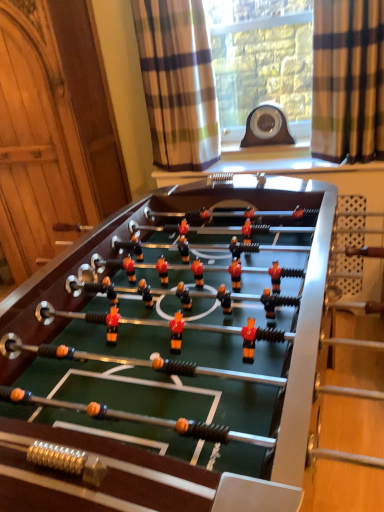
What do you see at coordinates (348, 80) in the screenshot? This screenshot has width=384, height=512. I see `brown plaid curtain at upper right, which is the first curtain in right-to-left order` at bounding box center [348, 80].

Where is `plaid fabric curtain at upper center, arranged as the 2th curtain when viewed from the right`? The height and width of the screenshot is (512, 384). plaid fabric curtain at upper center, arranged as the 2th curtain when viewed from the right is located at coordinates (178, 83).

Is there a large distance between brown plaid curtain at upper right, which is the first curtain in right-to-left order, and green felt table at center?

They are positioned close to each other.

From the picture: Is green felt table at center located within brown plaid curtain at upper right, which is the first curtain in right-to-left order?

No, green felt table at center is not a part of brown plaid curtain at upper right, which is the first curtain in right-to-left order.

Between brown plaid curtain at upper right, placed as the 2th curtain when sorted from left to right, and green felt table at center, which one has smaller width?

brown plaid curtain at upper right, placed as the 2th curtain when sorted from left to right, is thinner.

Can you confirm if green felt table at center is smaller than plaid fabric curtain at upper center, the first curtain viewed from the left?

No, green felt table at center is not smaller than plaid fabric curtain at upper center, the first curtain viewed from the left.

From a real-world perspective, is green felt table at center located higher than plaid fabric curtain at upper center, the first curtain viewed from the left?

No.

Is green felt table at center to the left of plaid fabric curtain at upper center, arranged as the 2th curtain when viewed from the right, from the viewer's perspective?

No.

Considering the positions of points (288, 280) and (202, 143), is point (288, 280) closer to camera compared to point (202, 143)?

Yes.

Which of these two, plaid fabric curtain at upper center, arranged as the 2th curtain when viewed from the right, or brown plaid curtain at upper right, which is the first curtain in right-to-left order, is thinner?

brown plaid curtain at upper right, which is the first curtain in right-to-left order.

Does plaid fabric curtain at upper center, arranged as the 2th curtain when viewed from the right, have a lesser height compared to brown plaid curtain at upper right, which is the first curtain in right-to-left order?

No.

Considering the sizes of objects plaid fabric curtain at upper center, arranged as the 2th curtain when viewed from the right, and brown plaid curtain at upper right, placed as the 2th curtain when sorted from left to right, in the image provided, who is smaller, plaid fabric curtain at upper center, arranged as the 2th curtain when viewed from the right, or brown plaid curtain at upper right, placed as the 2th curtain when sorted from left to right,?

With smaller size is brown plaid curtain at upper right, placed as the 2th curtain when sorted from left to right.

Can you tell me how much plaid fabric curtain at upper center, the first curtain viewed from the left, and brown plaid curtain at upper right, which is the first curtain in right-to-left order, differ in facing direction?

The angular difference between plaid fabric curtain at upper center, the first curtain viewed from the left, and brown plaid curtain at upper right, which is the first curtain in right-to-left order, is 2.56 degrees.

Which object is further away from the camera, plaid fabric curtain at upper center, arranged as the 2th curtain when viewed from the right, or green felt table at center?

plaid fabric curtain at upper center, arranged as the 2th curtain when viewed from the right, is more distant.

This screenshot has height=512, width=384. In order to click on table to the right of plaid fabric curtain at upper center, arranged as the 2th curtain when viewed from the right in this screenshot , I will do `click(167, 376)`.

Is plaid fabric curtain at upper center, the first curtain viewed from the left, aimed at green felt table at center?

Yes, plaid fabric curtain at upper center, the first curtain viewed from the left, is turned towards green felt table at center.

From a real-world perspective, is green felt table at center physically below brown plaid curtain at upper right, which is the first curtain in right-to-left order?

Indeed, from a real-world perspective, green felt table at center is positioned beneath brown plaid curtain at upper right, which is the first curtain in right-to-left order.

From the image's perspective, is green felt table at center over brown plaid curtain at upper right, which is the first curtain in right-to-left order?

Incorrect, from the image's perspective, green felt table at center is lower than brown plaid curtain at upper right, which is the first curtain in right-to-left order.

Between green felt table at center and brown plaid curtain at upper right, placed as the 2th curtain when sorted from left to right, which one has smaller width?

With smaller width is brown plaid curtain at upper right, placed as the 2th curtain when sorted from left to right.

From the image's perspective, is brown plaid curtain at upper right, placed as the 2th curtain when sorted from left to right, beneath plaid fabric curtain at upper center, arranged as the 2th curtain when viewed from the right?

Correct, brown plaid curtain at upper right, placed as the 2th curtain when sorted from left to right, appears lower than plaid fabric curtain at upper center, arranged as the 2th curtain when viewed from the right, in the image.

Can you confirm if brown plaid curtain at upper right, which is the first curtain in right-to-left order, is wider than plaid fabric curtain at upper center, arranged as the 2th curtain when viewed from the right?

Incorrect, the width of brown plaid curtain at upper right, which is the first curtain in right-to-left order, does not surpass that of plaid fabric curtain at upper center, arranged as the 2th curtain when viewed from the right.

In the image, there is a brown plaid curtain at upper right, which is the first curtain in right-to-left order. What are the coordinates of `curtain above it (from the image's perspective)` in the screenshot? It's located at (178, 83).

You are a GUI agent. You are given a task and a screenshot of the screen. Output one action in this format:
    pyautogui.click(x=<x>, y=<y>)
    Task: Click on the 1st curtain behind the green felt table at center
    Image resolution: width=384 pixels, height=512 pixels.
    Given the screenshot: What is the action you would take?
    pyautogui.click(x=348, y=80)

I want to click on curtain to the left of green felt table at center, so click(x=178, y=83).

Based on their spatial positions, is plaid fabric curtain at upper center, arranged as the 2th curtain when viewed from the right, or brown plaid curtain at upper right, which is the first curtain in right-to-left order, closer to green felt table at center?

plaid fabric curtain at upper center, arranged as the 2th curtain when viewed from the right, is closer to green felt table at center.

From the image, which object appears to be farther from brown plaid curtain at upper right, which is the first curtain in right-to-left order, plaid fabric curtain at upper center, the first curtain viewed from the left, or green felt table at center?

green felt table at center is further to brown plaid curtain at upper right, which is the first curtain in right-to-left order.

Looking at the image, which one is located closer to plaid fabric curtain at upper center, arranged as the 2th curtain when viewed from the right, green felt table at center or brown plaid curtain at upper right, which is the first curtain in right-to-left order?

brown plaid curtain at upper right, which is the first curtain in right-to-left order, is positioned closer to the anchor plaid fabric curtain at upper center, arranged as the 2th curtain when viewed from the right.

From the image, which object appears to be farther from brown plaid curtain at upper right, placed as the 2th curtain when sorted from left to right, green felt table at center or plaid fabric curtain at upper center, arranged as the 2th curtain when viewed from the right?

green felt table at center.

Which object lies further to the anchor point plaid fabric curtain at upper center, arranged as the 2th curtain when viewed from the right, brown plaid curtain at upper right, placed as the 2th curtain when sorted from left to right, or green felt table at center?

green felt table at center is positioned further to the anchor plaid fabric curtain at upper center, arranged as the 2th curtain when viewed from the right.

Estimate the real-world distances between objects in this image. Which object is closer to green felt table at center, brown plaid curtain at upper right, which is the first curtain in right-to-left order, or plaid fabric curtain at upper center, arranged as the 2th curtain when viewed from the right?

plaid fabric curtain at upper center, arranged as the 2th curtain when viewed from the right, is positioned closer to the anchor green felt table at center.

Find the location of a particular element. curtain between green felt table at center and plaid fabric curtain at upper center, arranged as the 2th curtain when viewed from the right, in the front-back direction is located at coordinates (348, 80).